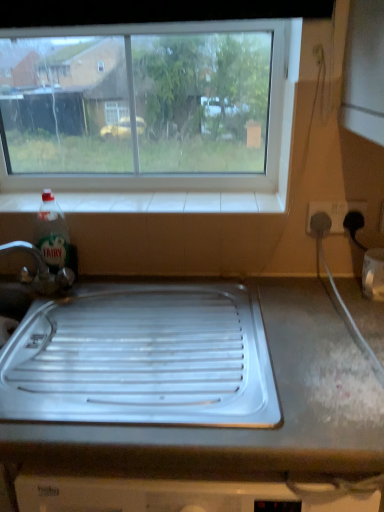
Measure the distance between point [331,212] and camera.

The distance of point [331,212] from camera is 1.08 meters.

Identify the location of transparent glass window at upper center. The height and width of the screenshot is (512, 384). (210, 176).

What is the approximate height of transparent glass window at upper center?

transparent glass window at upper center is 18.43 inches in height.

Find the location of a particular element. The image size is (384, 512). white tile at upper center is located at coordinates (171, 202).

Identify the location of white plastic socket at right. (334, 212).

Does transparent glass window at upper center come behind green translucent liquid at bottle left?

Yes, transparent glass window at upper center is further from the viewer.

Would you say transparent glass window at upper center contains green translucent liquid at bottle left?

No, green translucent liquid at bottle left is located outside of transparent glass window at upper center.

Considering the sizes of objects transparent glass window at upper center and green translucent liquid at bottle left in the image provided, who is taller, transparent glass window at upper center or green translucent liquid at bottle left?

Standing taller between the two is transparent glass window at upper center.

From the image's perspective, does transparent glass window at upper center appear lower than green translucent liquid at bottle left?

Incorrect, from the image's perspective, transparent glass window at upper center is higher than green translucent liquid at bottle left.

From a real-world perspective, is green translucent liquid at bottle left positioned under white tile at upper center based on gravity?

Yes, from a real-world perspective, green translucent liquid at bottle left is beneath white tile at upper center.

From the image's perspective, which object appears higher, green translucent liquid at bottle left or white tile at upper center?

white tile at upper center appears higher in the image.

Do you think green translucent liquid at bottle left is within white tile at upper center, or outside of it?

green translucent liquid at bottle left is not inside white tile at upper center, it's outside.

Does green translucent liquid at bottle left lie behind white tile at upper center?

No, green translucent liquid at bottle left is in front of white tile at upper center.

Does white tile at upper center touch white plastic socket at right?

No, white tile at upper center is not beside white plastic socket at right.

Which is closer to the camera, (83, 206) or (338, 206)?

The point (338, 206) is in front.

Is white tile at upper center closer to the viewer compared to white plastic socket at right?

No, it is behind white plastic socket at right.

Consider the image. From the image's perspective, is white tile at upper center on top of white plastic socket at right?

Yes.

Which object is positioned more to the left, white plastic socket at right or white tile at upper center?

From the viewer's perspective, white tile at upper center appears more on the left side.

In the scene shown: Considering the sizes of objects white plastic socket at right and white tile at upper center in the image provided, who is bigger, white plastic socket at right or white tile at upper center?

white tile at upper center is bigger.

Is white plastic socket at right beside white tile at upper center?

There is a gap between white plastic socket at right and white tile at upper center.

Between white plastic socket at right and white tile at upper center, which one has more height?

white plastic socket at right is taller.

Where is `electric outlet above the green translucent liquid at bottle left (from a real-world perspective)`? Image resolution: width=384 pixels, height=512 pixels. electric outlet above the green translucent liquid at bottle left (from a real-world perspective) is located at coordinates (334, 212).

Who is smaller, white plastic socket at right or green translucent liquid at bottle left?

Smaller between the two is white plastic socket at right.

How much distance is there between white plastic socket at right and green translucent liquid at bottle left?

The distance of white plastic socket at right from green translucent liquid at bottle left is 26.89 inches.

From the image's perspective, is white plastic socket at right located above green translucent liquid at bottle left?

Yes, from the image's perspective, white plastic socket at right is above green translucent liquid at bottle left.

Based on the photo, can you confirm if metallic gray tray at center is wider than transparent glass window at upper center?

Yes.

From a real-world perspective, between metallic gray tray at center and transparent glass window at upper center, who is vertically higher?

transparent glass window at upper center, from a real-world perspective.

Is metallic gray tray at center facing towards transparent glass window at upper center?

No, metallic gray tray at center does not turn towards transparent glass window at upper center.

Measure the distance between metallic gray tray at center and white plastic socket at right.

They are 20.95 inches apart.

Which is behind, point (212, 426) or point (364, 208)?

Point (364, 208)

Is metallic gray tray at center looking in the opposite direction of white plastic socket at right?

metallic gray tray at center is not turned away from white plastic socket at right.

Does metallic gray tray at center have a larger size compared to white plastic socket at right?

Yes.

Find the location of `bottle that appears below the transparent glass window at upper center (from the image's perspective)`. bottle that appears below the transparent glass window at upper center (from the image's perspective) is located at coordinates (53, 234).

The width and height of the screenshot is (384, 512). In order to click on window sill on the right of green translucent liquid at bottle left in this screenshot , I will do `click(171, 202)`.

Considering their positions, is white plastic socket at right positioned further to green translucent liquid at bottle left than transparent glass window at upper center?

Among the two, white plastic socket at right is located further to green translucent liquid at bottle left.

Looking at the image, which one is located further to white tile at upper center, white plastic socket at right or metallic gray tray at center?

metallic gray tray at center.

From the image, which object appears to be nearer to transparent glass window at upper center, green translucent liquid at bottle left or metallic gray tray at center?

green translucent liquid at bottle left lies closer to transparent glass window at upper center than the other object.

Considering their positions, is metallic gray tray at center positioned closer to green translucent liquid at bottle left than white tile at upper center?

white tile at upper center is closer to green translucent liquid at bottle left.

When comparing their distances from metallic gray tray at center, does transparent glass window at upper center or white tile at upper center seem further?

transparent glass window at upper center.

Estimate the real-world distances between objects in this image. Which object is closer to transparent glass window at upper center, metallic gray tray at center or green translucent liquid at bottle left?

Based on the image, green translucent liquid at bottle left appears to be nearer to transparent glass window at upper center.

Estimate the real-world distances between objects in this image. Which object is closer to metallic gray tray at center, white plastic socket at right or green translucent liquid at bottle left?

Based on the image, green translucent liquid at bottle left appears to be nearer to metallic gray tray at center.

When comparing their distances from white tile at upper center, does transparent glass window at upper center or metallic gray tray at center seem further?

The object further to white tile at upper center is metallic gray tray at center.

Locate an element on the screen. The image size is (384, 512). window located between green translucent liquid at bottle left and white plastic socket at right in the left-right direction is located at coordinates (210, 176).

Where is `electric outlet between transparent glass window at upper center and metallic gray tray at center vertically`? The height and width of the screenshot is (512, 384). electric outlet between transparent glass window at upper center and metallic gray tray at center vertically is located at coordinates (334, 212).

The height and width of the screenshot is (512, 384). In order to click on window sill situated between green translucent liquid at bottle left and white plastic socket at right from left to right in this screenshot , I will do `click(171, 202)`.

Where is `window sill between transparent glass window at upper center and green translucent liquid at bottle left vertically`? window sill between transparent glass window at upper center and green translucent liquid at bottle left vertically is located at coordinates (171, 202).